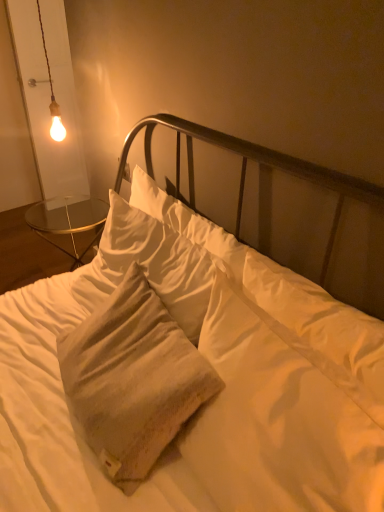
What are the coordinates of `beige textured pillow at center` in the screenshot? It's located at point(286,300).

Describe the element at coordinates (286, 300) in the screenshot. I see `beige textured pillow at center` at that location.

Measure the distance between point (136, 175) and camera.

They are 5.16 feet apart.

Find the location of a particular element. The height and width of the screenshot is (512, 384). beige textured pillow at center is located at coordinates (286, 300).